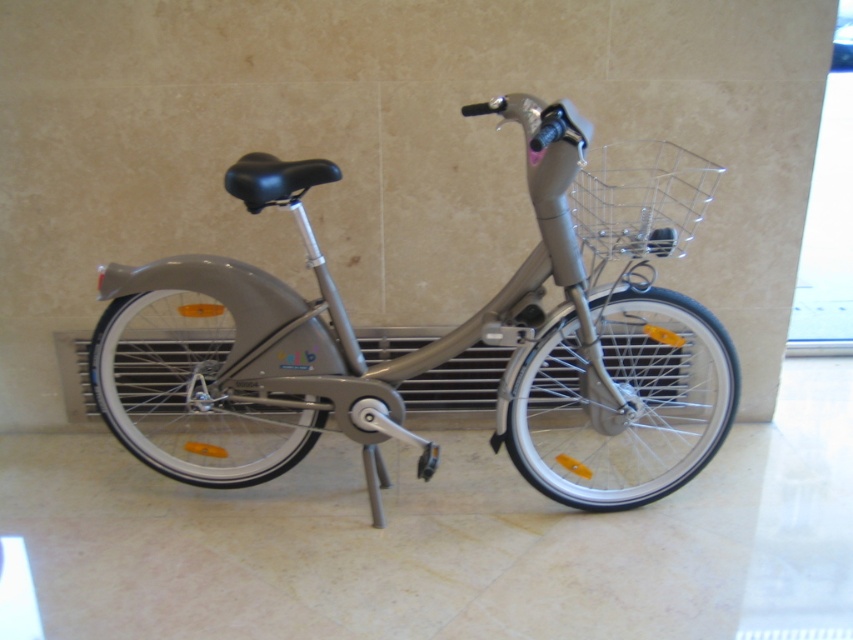
Question: Which of the following is the closest to the observer?

Choices:
 (A) (628, 196)
 (B) (456, 388)
 (C) (242, 180)

Answer: (C)

Question: Can you confirm if metallic gray bicycle at center is positioned to the right of metallic wire basket at upper right?

Choices:
 (A) yes
 (B) no

Answer: (B)

Question: From the image, what is the correct spatial relationship of metallic gray bicycle at center in relation to metallic gray radiator at center?

Choices:
 (A) below
 (B) above

Answer: (B)

Question: Which of the following is the closest to the observer?

Choices:
 (A) metallic wire basket at upper right
 (B) metallic gray bicycle at center
 (C) metallic gray radiator at center

Answer: (B)

Question: Does metallic wire basket at upper right have a smaller size compared to metallic gray radiator at center?

Choices:
 (A) yes
 (B) no

Answer: (B)

Question: Which point appears farthest from the camera in this image?

Choices:
 (A) (669, 156)
 (B) (183, 268)

Answer: (A)